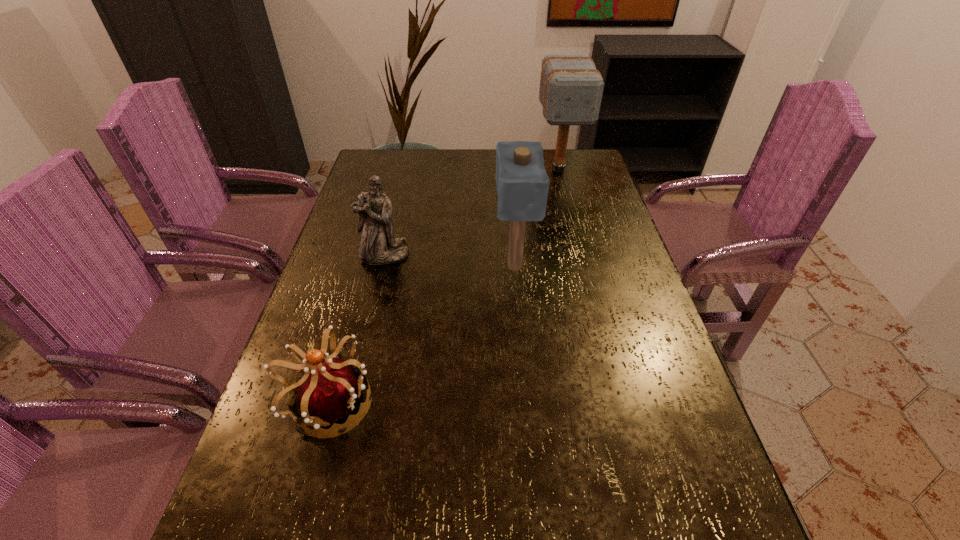
Identify the location of object that is the second closest to the farther mallet. (378, 246).

I want to click on the second closest object to the farthest object, so click(378, 246).

Where is `free space in the image that satisfies the following two spatial constraints: 1. on the front-facing side of the figurine; 2. on the front-facing side of the shortest object`? The image size is (960, 540). free space in the image that satisfies the following two spatial constraints: 1. on the front-facing side of the figurine; 2. on the front-facing side of the shortest object is located at coordinates (348, 403).

Locate an element on the screen. The width and height of the screenshot is (960, 540). free location that satisfies the following two spatial constraints: 1. on the front side of the left mallet; 2. on the front-facing side of the tiara is located at coordinates (526, 403).

The height and width of the screenshot is (540, 960). I want to click on free space in the image that satisfies the following two spatial constraints: 1. on the front-facing side of the second shortest object; 2. on the front-facing side of the nearest object, so click(348, 403).

Identify the location of vacant space that satisfies the following two spatial constraints: 1. on the striking surface of the farther mallet; 2. on the front-facing side of the nearest object. (618, 403).

Locate an element on the screen. The width and height of the screenshot is (960, 540). vacant position in the image that satisfies the following two spatial constraints: 1. on the front-facing side of the figurine; 2. on the front-facing side of the tiara is located at coordinates (348, 403).

This screenshot has height=540, width=960. Identify the location of vacant space that satisfies the following two spatial constraints: 1. on the front-facing side of the figurine; 2. on the front-facing side of the nearest object. (348, 403).

Identify the location of free spot that satisfies the following two spatial constraints: 1. on the front side of the nearer mallet; 2. on the front-facing side of the nearest object. Image resolution: width=960 pixels, height=540 pixels. (526, 403).